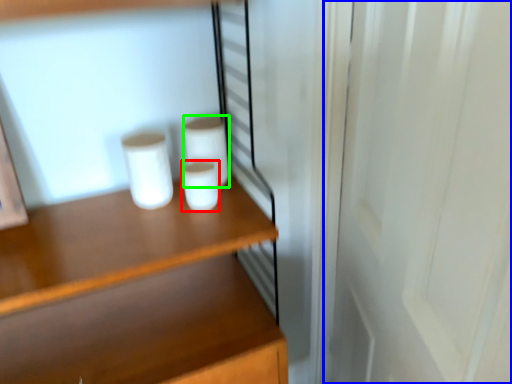
Question: Considering the real-world distances, which object is closest to paper towel (highlighted by a red box)? screen door (highlighted by a blue box) or paper towel (highlighted by a green box).

Choices:
 (A) screen door
 (B) paper towel

Answer: (B)